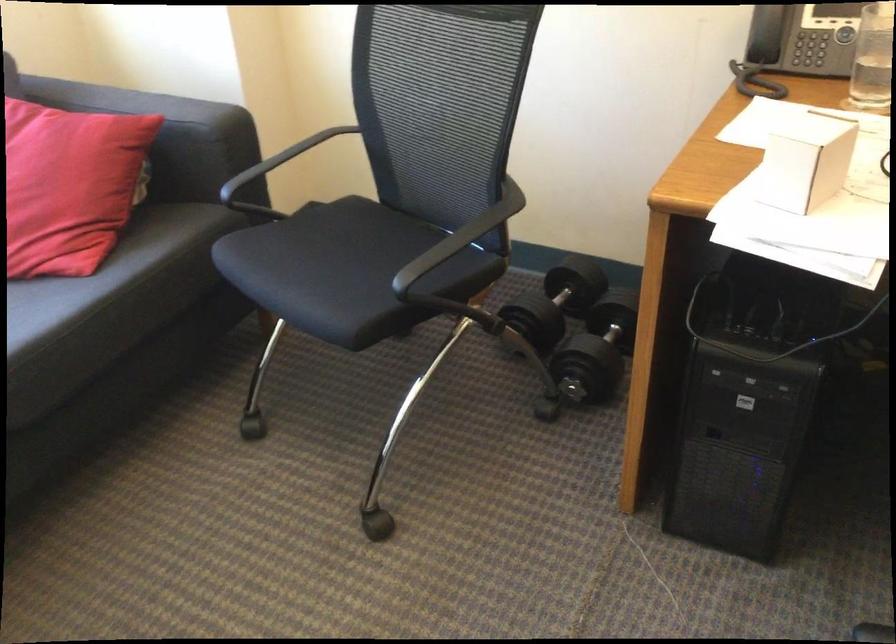
At what (x,y) coordinates should I click in order to perform the action: click on red pillow. Please return your answer as a coordinate pair (x, y). The width and height of the screenshot is (896, 644). Looking at the image, I should click on (69, 185).